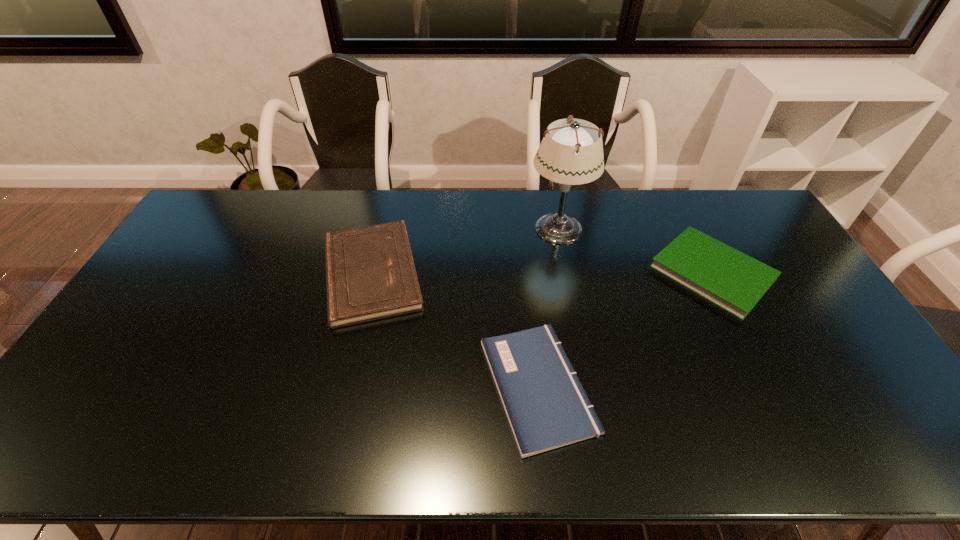
Find the location of a particular element. free space at the far right corner of the desktop is located at coordinates (737, 195).

The image size is (960, 540). What are the coordinates of `free spot between the rightmost object and the shortest paperback book` in the screenshot? It's located at (625, 329).

Where is `unoccupied area between the lampshade and the shortest paperback book`? unoccupied area between the lampshade and the shortest paperback book is located at coordinates (548, 307).

The height and width of the screenshot is (540, 960). In order to click on free space that is in between the leftmost paperback book and the shortest paperback book in this screenshot , I will do pos(455,330).

I want to click on vacant space that's between the rightmost paperback book and the leftmost paperback book, so click(x=542, y=273).

Locate an element on the screen. The height and width of the screenshot is (540, 960). vacant space in between the leftmost paperback book and the second paperback book from left to right is located at coordinates (455, 330).

At what (x,y) coordinates should I click in order to perform the action: click on free space between the tallest object and the rightmost object. Please return your answer as a coordinate pair (x, y). The width and height of the screenshot is (960, 540). Looking at the image, I should click on (636, 250).

Find the location of a particular element. This screenshot has width=960, height=540. blank region between the shortest paperback book and the lampshade is located at coordinates (548, 307).

Find the location of a particular element. vacant space that's between the rightmost object and the lampshade is located at coordinates (636, 250).

Find the location of `empty space that is in between the rightmost paperback book and the tallest object`. empty space that is in between the rightmost paperback book and the tallest object is located at coordinates (636, 250).